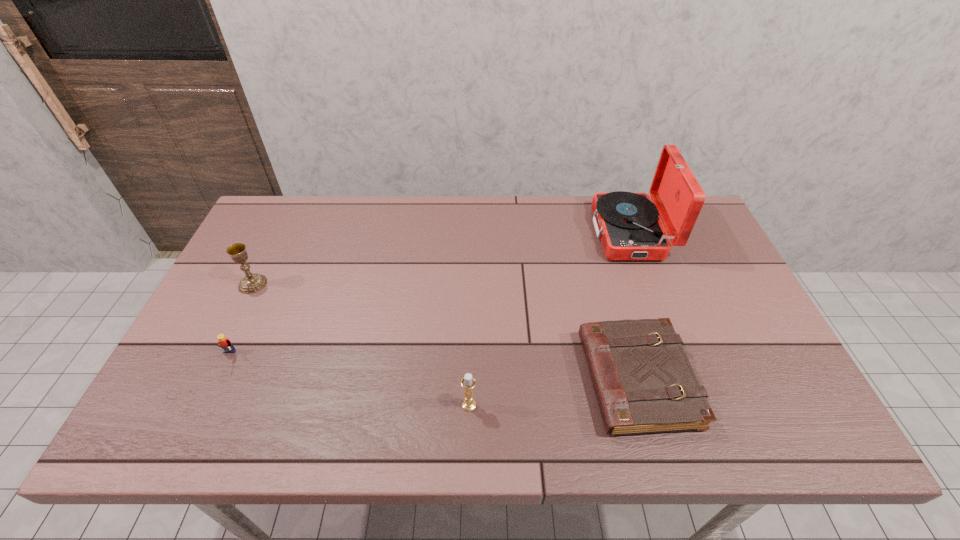
The image size is (960, 540). Find the location of `free space between the second shortest object and the farthest object`. free space between the second shortest object and the farthest object is located at coordinates (429, 295).

I want to click on vacant space that is in between the Lego and the tallest object, so click(429, 295).

Locate an element on the screen. This screenshot has height=540, width=960. free space between the Lego and the chalice is located at coordinates (240, 320).

Find the location of `vacant space that is in between the chalice and the Lego`. vacant space that is in between the chalice and the Lego is located at coordinates (240, 320).

You are a GUI agent. You are given a task and a screenshot of the screen. Output one action in this format:
    pyautogui.click(x=<x>, y=<y>)
    Task: Click on the free space between the third object from left to right and the second shortest object
    This screenshot has width=960, height=540.
    Given the screenshot: What is the action you would take?
    pyautogui.click(x=348, y=381)

This screenshot has width=960, height=540. In order to click on free space between the farthest object and the candle holder in this screenshot , I will do `click(549, 319)`.

Find the location of a particular element. The image size is (960, 540). the third closest object to the third object from right to left is located at coordinates (629, 227).

You are a GUI agent. You are given a task and a screenshot of the screen. Output one action in this format:
    pyautogui.click(x=<x>, y=<y>)
    Task: Click on the object that ranks as the closest to the fourth nearest object
    The width and height of the screenshot is (960, 540).
    Given the screenshot: What is the action you would take?
    pyautogui.click(x=224, y=343)

Locate an element on the screen. The width and height of the screenshot is (960, 540). vacant region that satisfies the following two spatial constraints: 1. on the front-facing side of the phonograph_record; 2. on the front-facing side of the fourth tallest object is located at coordinates (675, 356).

What are the coordinates of `free space in the image that satisfies the following two spatial constraints: 1. on the front-facing side of the farthest object; 2. on the front side of the shortest object` in the screenshot? It's located at (683, 379).